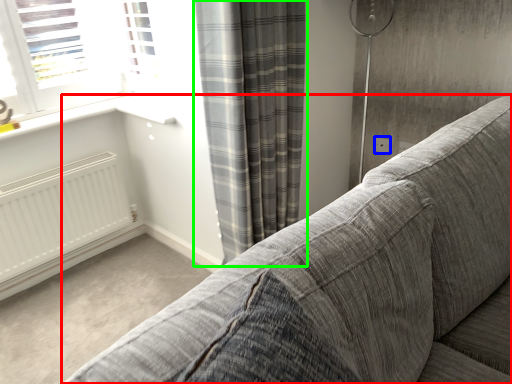
Question: Which object is the closest to the studio couch (highlighted by a red box)? Choose among these: electric outlet (highlighted by a blue box) or curtain (highlighted by a green box).

Choices:
 (A) electric outlet
 (B) curtain

Answer: (B)